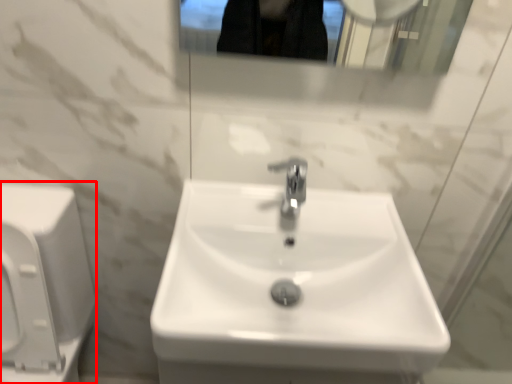
Question: Observing the image, what is the correct spatial positioning of porcelain (annotated by the red box) in reference to sink?

Choices:
 (A) left
 (B) right

Answer: (A)